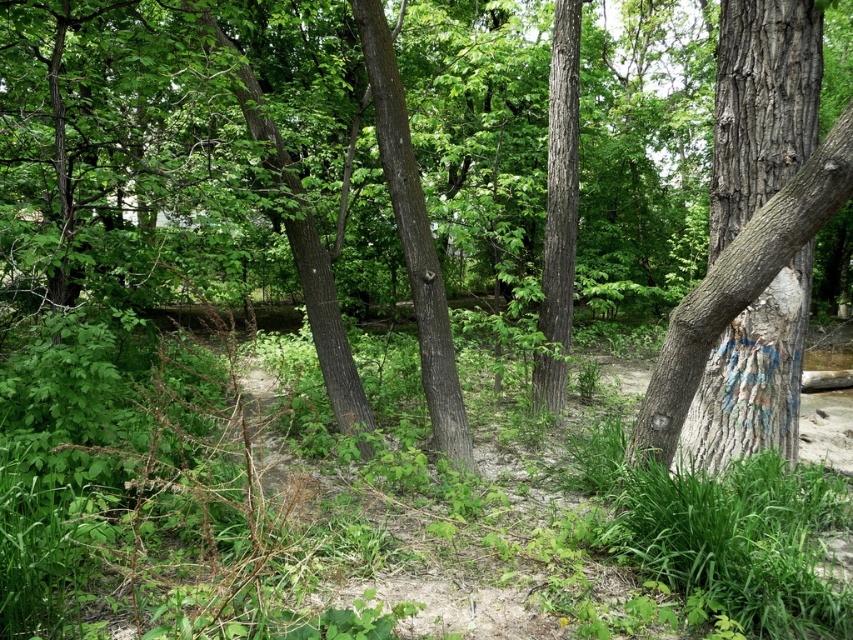
You are a hiker navigating through the forest and need to identify the position of the trees. Which tree is positioned lower in the image, the smooth gray bark tree at right or the smooth brown tree trunk at center?

A: The smooth gray bark tree at right is positioned lower than the smooth brown tree trunk at center in the image.

You are a hiker who wants to take a photo of the smooth gray bark tree at right. Your camera has a maximum focus range of 4 meters. Can you capture the tree clearly without moving closer?

The smooth gray bark tree at right is 3.86 meters away from camera, so yes, the camera can focus on it clearly since the distance is within the 4 meter range.

You are a hiker who wants to take a photo of the smooth bark tree trunk at center and the smooth brown tree trunk at center. Which one is positioned lower in the scene?

The smooth bark tree trunk at center is located below the smooth brown tree trunk at center, so it is positioned lower in the scene.